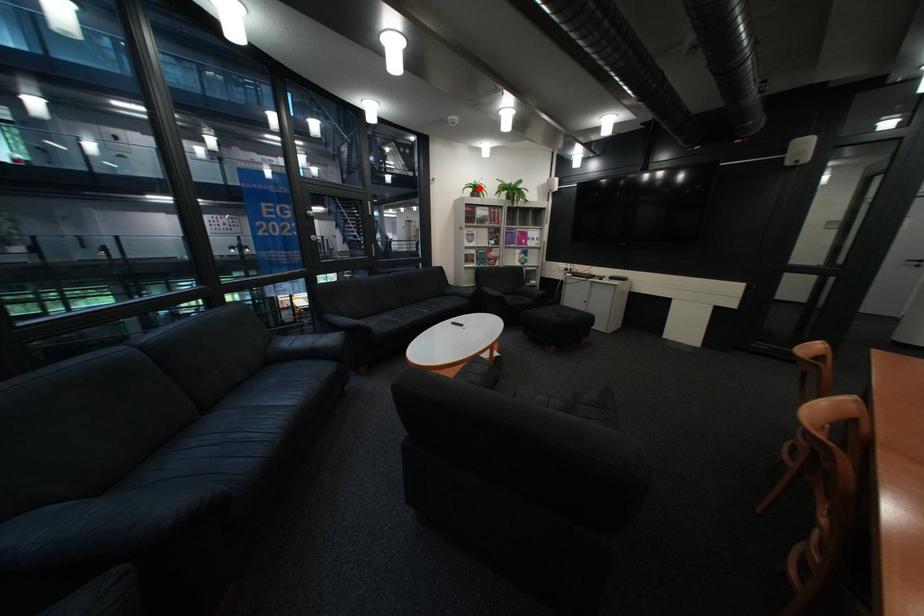
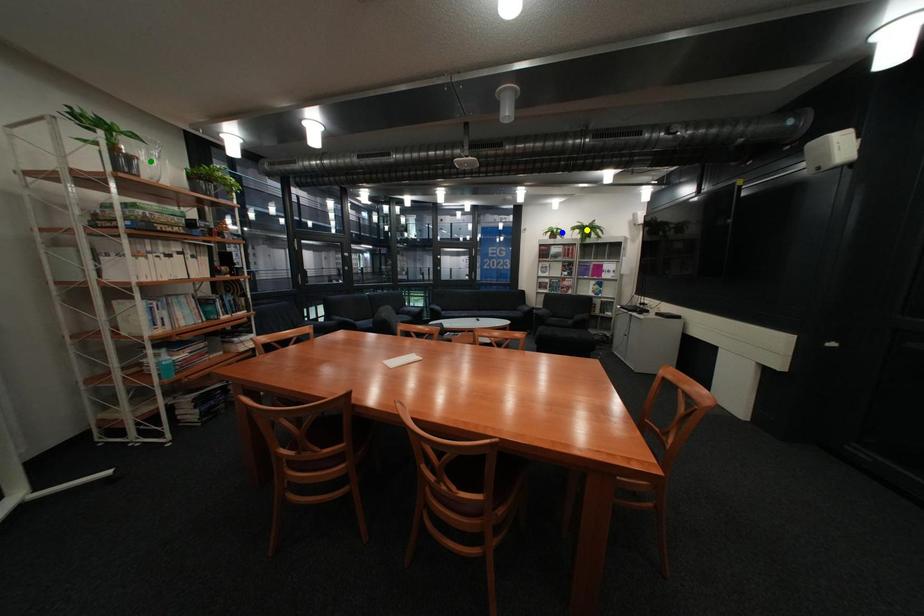
Question: I am providing you with two images of the same scene from different viewpoints. A red point is marked on the first image. You are given multiple points on the second image. In image 2, which mark is for the same physical point as the one in image 1?

Choices:
 (A) blue point
 (B) green point
 (C) yellow point

Answer: (A)